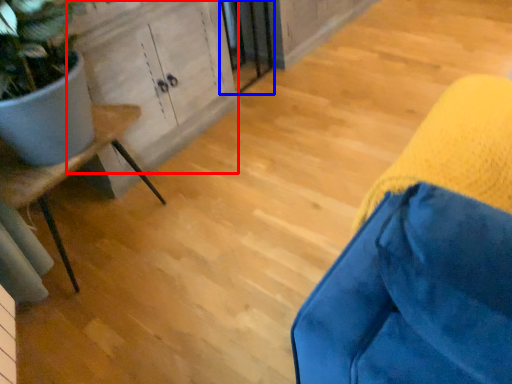
Question: Which object appears closest to the camera in this image, cabinetry (highlighted by a red box) or screen door (highlighted by a blue box)?

Choices:
 (A) cabinetry
 (B) screen door

Answer: (A)